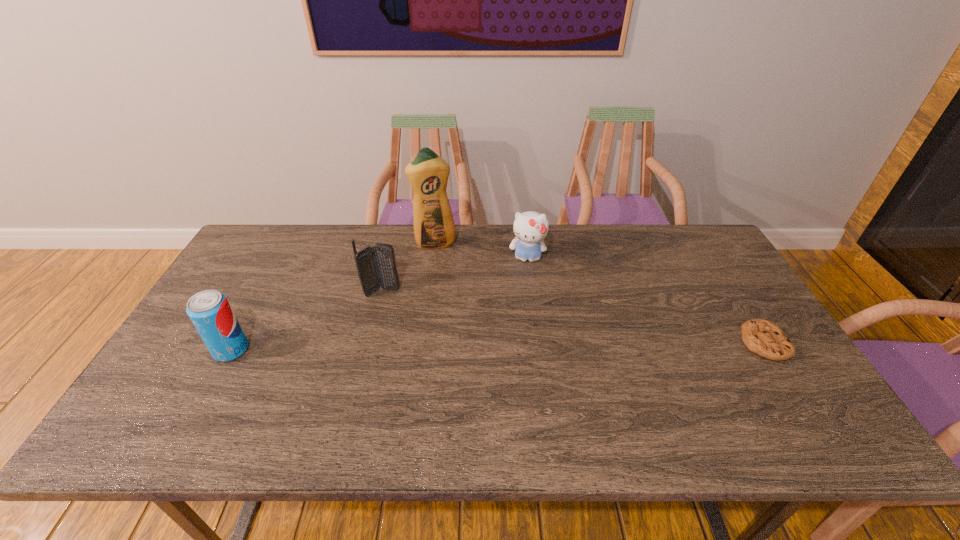
You are a GUI agent. You are given a task and a screenshot of the screen. Output one action in this format:
    pyautogui.click(x=<x>, y=<y>)
    Task: Click on the kitten situated at the far edge
    The image size is (960, 540).
    Given the screenshot: What is the action you would take?
    pyautogui.click(x=530, y=228)

This screenshot has width=960, height=540. Identify the location of object located at the left edge. (210, 312).

Image resolution: width=960 pixels, height=540 pixels. In order to click on object situated at the right edge in this screenshot , I will do `click(765, 338)`.

This screenshot has width=960, height=540. In order to click on vacant space at the far edge in this screenshot , I will do `click(302, 241)`.

Identify the location of free space at the near edge. (642, 402).

Image resolution: width=960 pixels, height=540 pixels. Find the location of `vacant space at the left edge of the desktop`. vacant space at the left edge of the desktop is located at coordinates (251, 277).

The width and height of the screenshot is (960, 540). In the image, there is a desktop. In order to click on vacant space at the right edge in this screenshot , I will do `click(727, 312)`.

The width and height of the screenshot is (960, 540). What are the coordinates of `blank space at the near left corner of the desktop` in the screenshot? It's located at (167, 401).

What are the coordinates of `empty location between the leftmost object and the tallest object` in the screenshot? It's located at (333, 297).

At what (x,y) coordinates should I click in order to perform the action: click on vacant region between the tallest object and the cellular telephone. Please return your answer as a coordinate pair (x, y). The width and height of the screenshot is (960, 540). Looking at the image, I should click on (408, 268).